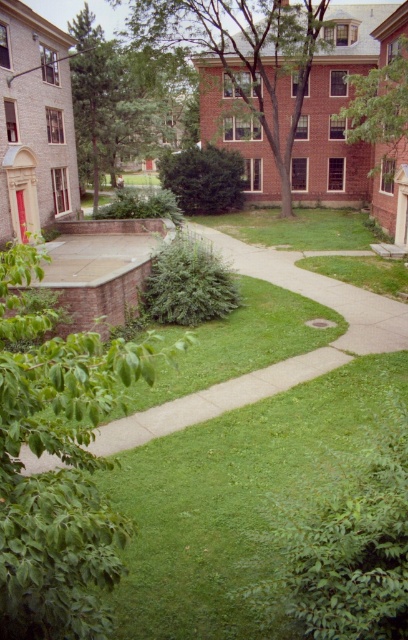
Is brown textured tree at upper center above green leafy tree at center?

No, brown textured tree at upper center is not above green leafy tree at center.

Is point (257, 104) closer to camera compared to point (99, 51)?

No, (257, 104) is behind (99, 51).

Locate an element on the screen. brown textured tree at upper center is located at coordinates (244, 54).

Is smooth concrete path at center positioned in front of green leafy tree at center?

Yes, smooth concrete path at center is closer to the viewer.

Is point (343, 333) closer to camera compared to point (113, 140)?

Yes, point (343, 333) is in front of point (113, 140).

Is point (219, 250) more distant than point (113, 147)?

No, it is not.

Find the location of `smooth concrete path at center`. smooth concrete path at center is located at coordinates click(x=274, y=364).

Which is more to the right, smooth concrete path at center or brown textured tree at upper center?

brown textured tree at upper center is more to the right.

Is smooth concrete path at center thinner than brown textured tree at upper center?

Yes, smooth concrete path at center is thinner than brown textured tree at upper center.

Who is more distant from viewer, (130, 432) or (257, 90)?

Positioned behind is point (257, 90).

You are a GUI agent. You are given a task and a screenshot of the screen. Output one action in this format:
    pyautogui.click(x=<x>, y=<y>)
    Task: Click on the smooth concrete path at center
    This screenshot has width=408, height=640.
    Given the screenshot: What is the action you would take?
    pyautogui.click(x=274, y=364)